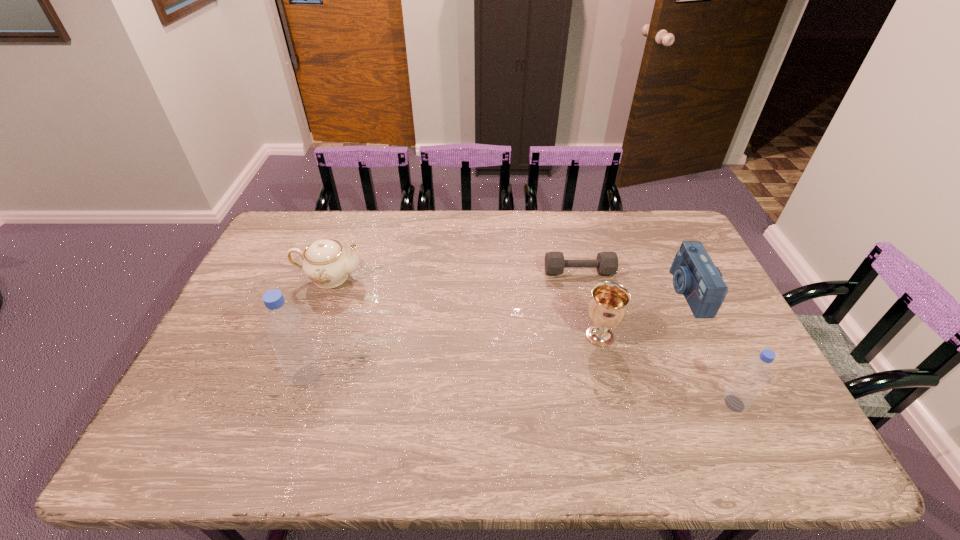
Where is `vacant space situated at the spout of the chinaware`? This screenshot has height=540, width=960. vacant space situated at the spout of the chinaware is located at coordinates (450, 278).

This screenshot has height=540, width=960. In order to click on vacant space positioned 0.190m on the back of the dumbbell in this screenshot , I will do `click(569, 230)`.

Where is `free region located 0.380m on the left of the chalice`? free region located 0.380m on the left of the chalice is located at coordinates (448, 336).

Find the location of a particular element. free region located on the lens of the camera is located at coordinates (636, 292).

The width and height of the screenshot is (960, 540). Find the location of `free location located on the lens of the camera`. free location located on the lens of the camera is located at coordinates 633,292.

Find the location of `vacant space situated on the lens of the camera`. vacant space situated on the lens of the camera is located at coordinates (626, 292).

Where is `object present at the left edge`? This screenshot has width=960, height=540. object present at the left edge is located at coordinates (325, 262).

Identify the location of bottle located at the right edge. The width and height of the screenshot is (960, 540). (753, 376).

At what (x,y) coordinates should I click in order to perform the action: click on camera that is at the right edge. Please return your answer as a coordinate pair (x, y). The image size is (960, 540). Looking at the image, I should click on (695, 276).

At what (x,y) coordinates should I click in order to perform the action: click on object located in the near right corner section of the desktop. Please return your answer as a coordinate pair (x, y). The width and height of the screenshot is (960, 540). Looking at the image, I should click on (753, 376).